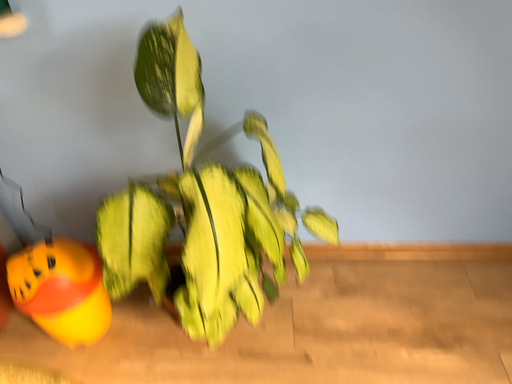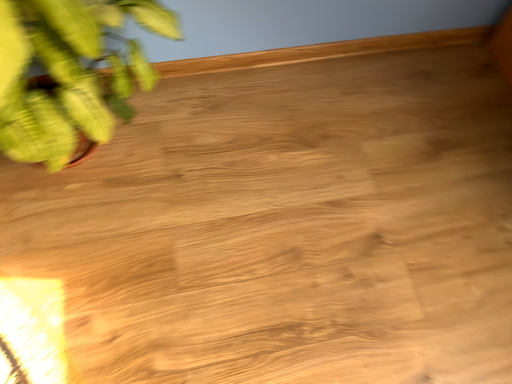
Question: How did the camera likely rotate when shooting the video?

Choices:
 (A) rotated left
 (B) rotated right

Answer: (B)